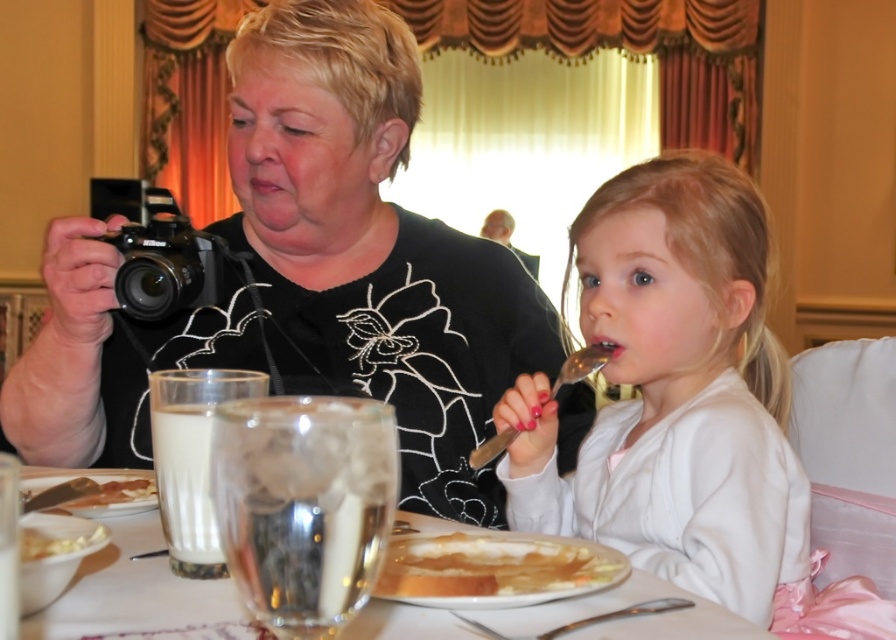
You are setting up a photography setup for a food photography shoot. You have a black matte camera at upper left and a clear glass plate at center. Which object should you choose if you need a larger surface to place the food items?

The black matte camera at upper left is larger in size than the clear glass plate at center, so you should choose the black matte camera at upper left to place the food items as it offers a larger surface.

You are standing at the entrance of the room and want to locate the smooth white shirt at center. According to the coordinates provided, in which direction relative to the center of the image should you look?

The smooth white shirt at center is located at coordinates point [674,392]. Since the coordinates are given as x,y values between 0 and 1, with [0,0] being the bottom left corner and [895,639] the top right corner, the shirt is to the right and slightly above the center point of the image.

You are a waiter at the table. You need to place a new menu between the clear glass plate at center and the white opaque glass at lower left. Which side should you place it on to keep it between them?

The clear glass plate at center is to the left of the white opaque glass at lower left. Therefore, to place the menu between them, you should put it to the right of the clear glass plate at center and to the left of the white opaque glass at lower left.